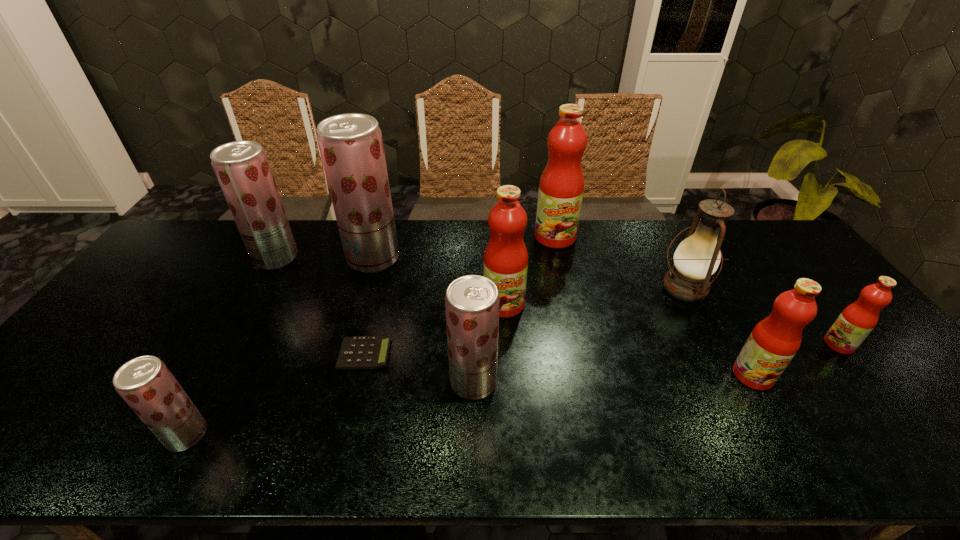
Find the location of a particular element. The width and height of the screenshot is (960, 540). the second nearest strawberry fruit juice is located at coordinates (472, 302).

Identify the location of the rightmost strawberry fruit juice. (472, 302).

The height and width of the screenshot is (540, 960). Find the location of `the fourth nearest fruit juice`. the fourth nearest fruit juice is located at coordinates (854, 324).

You are a GUI agent. You are given a task and a screenshot of the screen. Output one action in this format:
    pyautogui.click(x=<x>, y=<y>)
    Task: Click on the smallest pink fruit juice
    This screenshot has width=960, height=540.
    Given the screenshot: What is the action you would take?
    pyautogui.click(x=854, y=324)

Where is `the nearest strawberry fruit juice`? This screenshot has width=960, height=540. the nearest strawberry fruit juice is located at coordinates 146,384.

I want to click on the smallest strawberry fruit juice, so click(x=146, y=384).

Where is `calculator`? The image size is (960, 540). calculator is located at coordinates (358, 352).

Locate an element on the screen. free region located 0.080m on the right of the sixth fruit juice from right to left is located at coordinates (424, 258).

What are the coordinates of `vacant region located 0.390m on the front label of the biggest pink fruit juice` in the screenshot? It's located at (577, 338).

Find the location of a particular element. This screenshot has height=540, width=960. free location located on the left of the second biggest strawberry fruit juice is located at coordinates (203, 258).